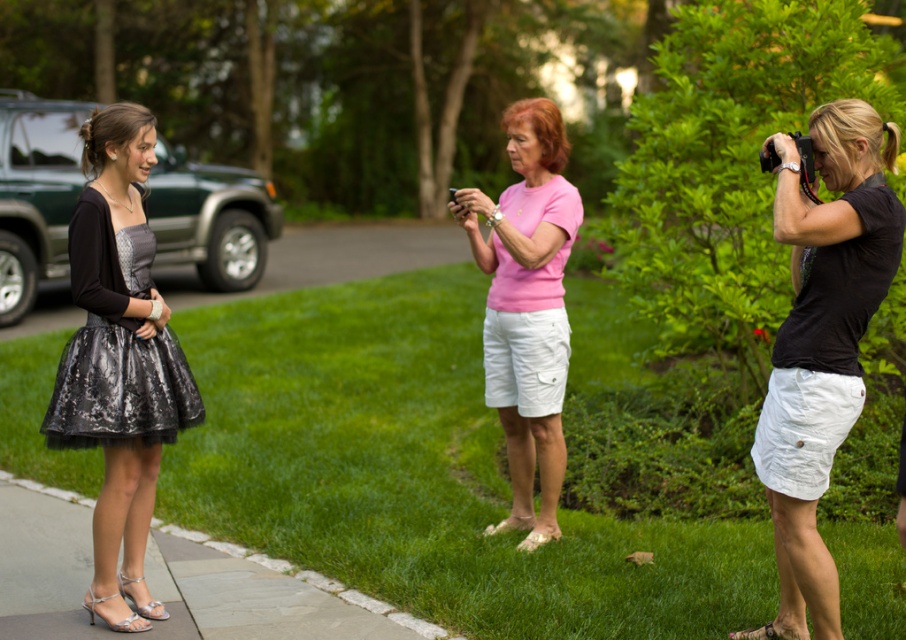
Question: Which of the following is the farthest from the observer?

Choices:
 (A) gray stone curb at lower left
 (B) black matte t-shirt at right
 (C) pink matte shirt at center
 (D) shiny black dress at left

Answer: (C)

Question: Among these objects, which one is farthest from the camera?

Choices:
 (A) black matte t-shirt at right
 (B) pink matte shirt at center
 (C) gray stone curb at lower left
 (D) shiny black dress at left

Answer: (B)

Question: Can you confirm if black matte t-shirt at right is thinner than pink matte shirt at center?

Choices:
 (A) yes
 (B) no

Answer: (A)

Question: Does black matte t-shirt at right appear over shiny black dress at left?

Choices:
 (A) no
 (B) yes

Answer: (A)

Question: Which object is closer to the camera taking this photo?

Choices:
 (A) black matte t-shirt at right
 (B) shiny black dress at left
 (C) pink matte shirt at center

Answer: (A)

Question: From the image, what is the correct spatial relationship of gray stone curb at lower left in relation to pink matte shirt at center?

Choices:
 (A) right
 (B) left

Answer: (B)